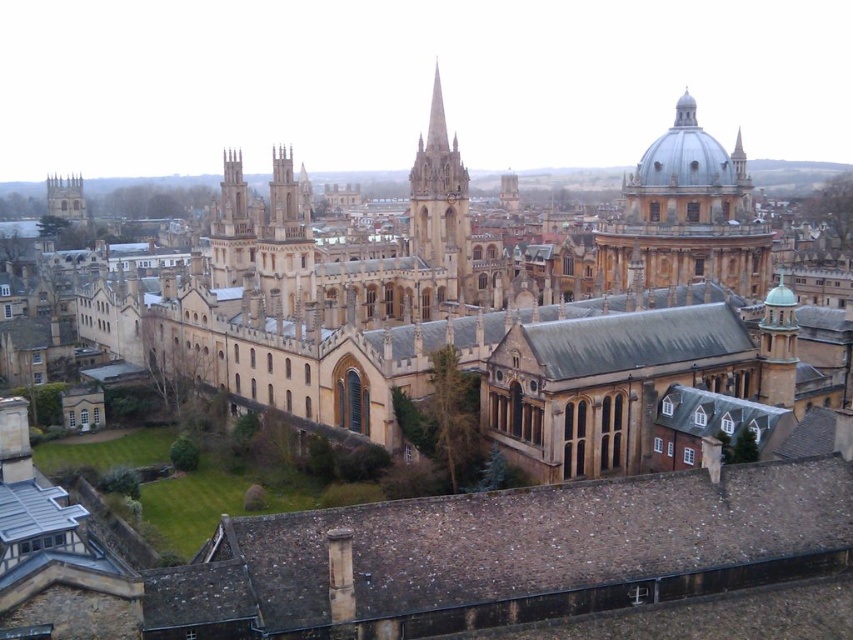
Does smooth stone dome at upper right have a lesser height compared to golden stone spire at center?

In fact, smooth stone dome at upper right may be taller than golden stone spire at center.

The image size is (853, 640). I want to click on smooth stone dome at upper right, so click(x=686, y=216).

Is point (732, 188) positioned before point (424, 168)?

That is True.

This screenshot has height=640, width=853. Identify the location of smooth stone dome at upper right. (686, 216).

What do you see at coordinates (506, 554) in the screenshot?
I see `brown stone roof at lower center` at bounding box center [506, 554].

Who is lower down, brown stone roof at lower center or smooth gray dome at upper right?

brown stone roof at lower center is lower down.

What do you see at coordinates (506, 554) in the screenshot?
I see `brown stone roof at lower center` at bounding box center [506, 554].

Locate an element on the screen. brown stone roof at lower center is located at coordinates (506, 554).

Who is taller, brown stone roof at lower center or smooth stone dome at upper right?

smooth stone dome at upper right is taller.

Between brown stone roof at lower center and smooth stone dome at upper right, which one is positioned higher?

smooth stone dome at upper right is higher up.

Looking at this image, who is more forward, (468, 609) or (662, 257)?

Point (468, 609) is in front.

This screenshot has width=853, height=640. I want to click on brown stone roof at lower center, so coord(506,554).